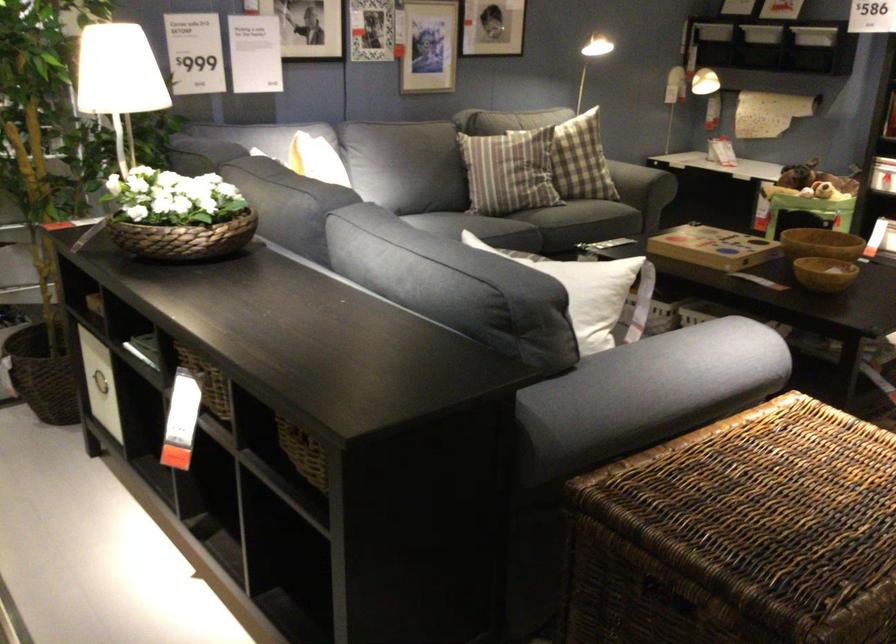
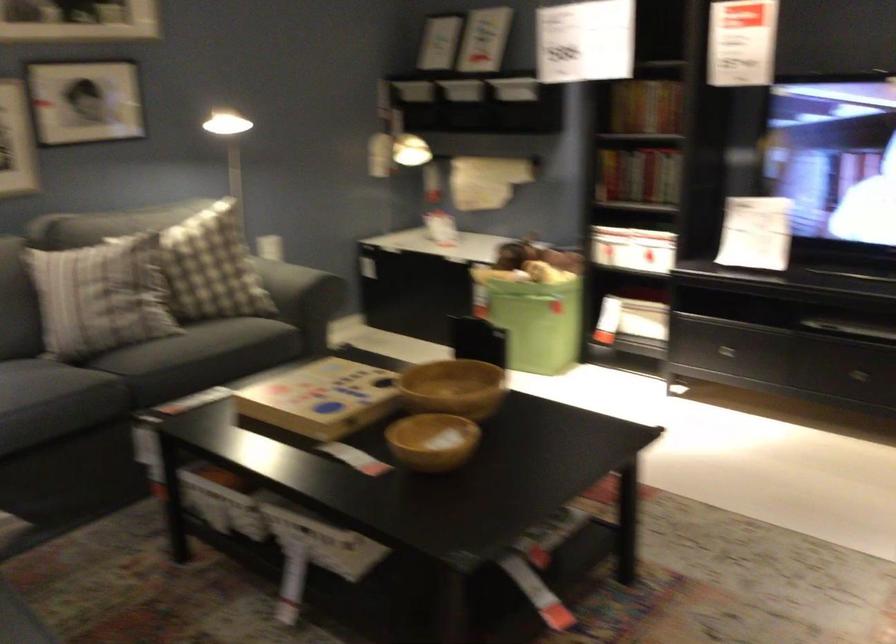
Find the pixel in the second image that matches (668,178) in the first image.

(286, 285)